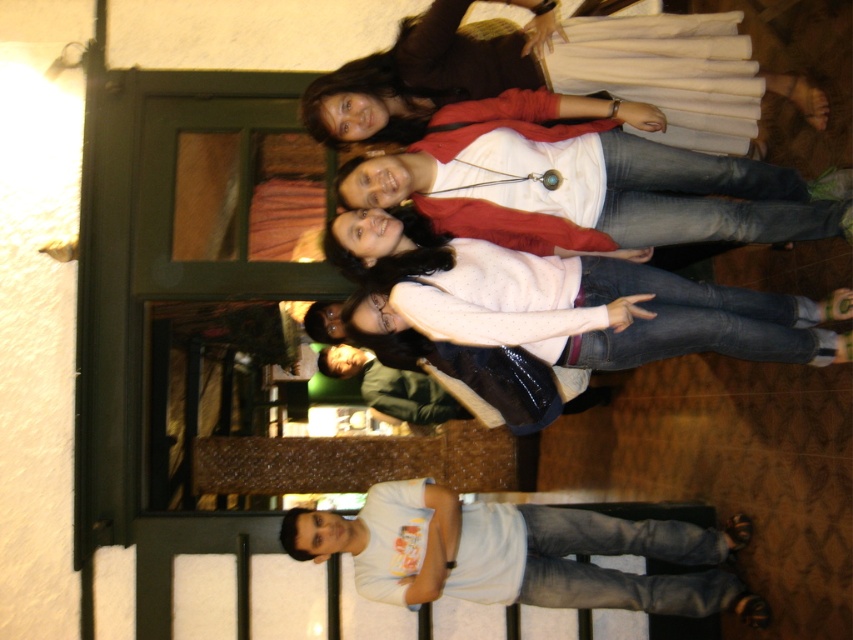
Measure the distance between white matte sweater at center and camera.

The distance of white matte sweater at center from camera is 9.77 feet.

Locate an element on the screen. This screenshot has height=640, width=853. white matte sweater at center is located at coordinates (567, 301).

Which of these two, white matte shirt at center or white matte t-shirt at lower center, stands shorter?

white matte t-shirt at lower center

Image resolution: width=853 pixels, height=640 pixels. In order to click on white matte shirt at center in this screenshot , I will do point(581,179).

Is point (666, 205) closer to camera compared to point (492, 554)?

Yes.

Identify the location of white matte shirt at center. The height and width of the screenshot is (640, 853). (581, 179).

From the picture: Is matte brown jacket at upper center thinner than white matte shirt at center?

No, matte brown jacket at upper center is not thinner than white matte shirt at center.

Who is more distant from viewer, [352,128] or [491,220]?

Point [352,128]

The height and width of the screenshot is (640, 853). I want to click on matte brown jacket at upper center, so coord(558,74).